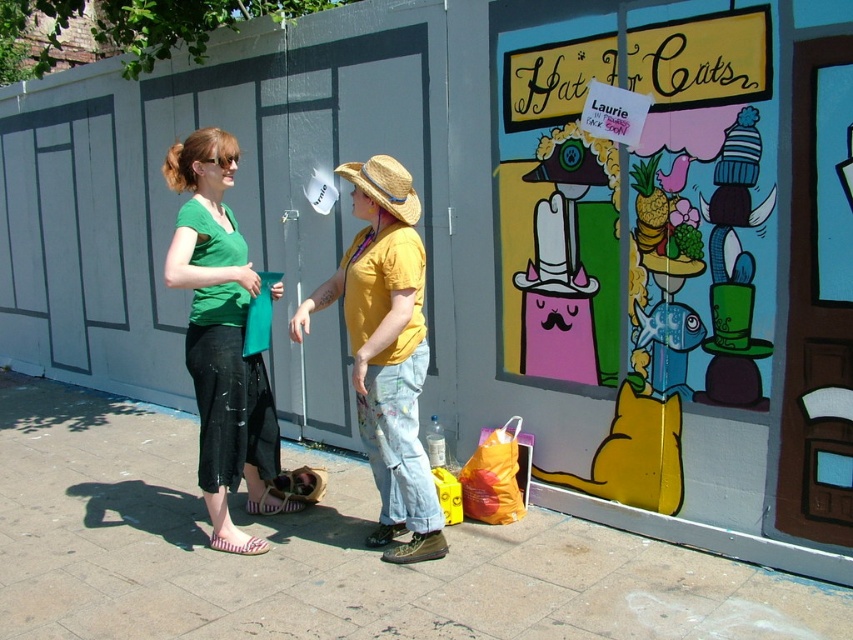
You are standing in front of the mural and want to place a small potted plant on the ground between the smooth concrete pavement at center and the matte yellow shirt at center. Is there enough space to place it there?

The smooth concrete pavement at center is to the right of the matte yellow shirt at center, so there is space between them to place the potted plant.

You are standing at the point with coordinates (x=325, y=554) in the image. What is the surface material under your feet?

The surface material at point (x=325, y=554) is smooth concrete pavement.

In the scene shown: You are a delivery person who needs to place a package on the smooth concrete pavement at center. The package is 1 meter long. Can you place it horizontally without overlapping the green matte shirt at center?

The smooth concrete pavement at center is to the right of green matte shirt at center, so placing the package horizontally on the pavement would not overlap the shirt since they are positioned side by side.